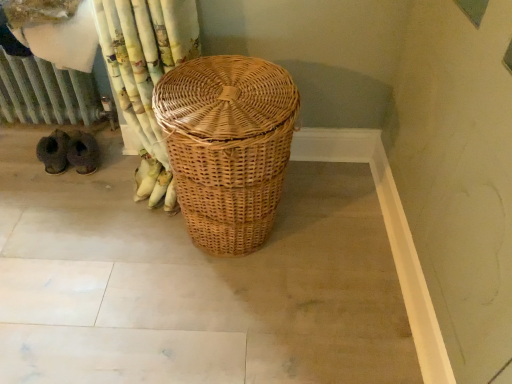
What are the coordinates of `vacant area that is in front of natural wicker basket at center` in the screenshot? It's located at (217, 324).